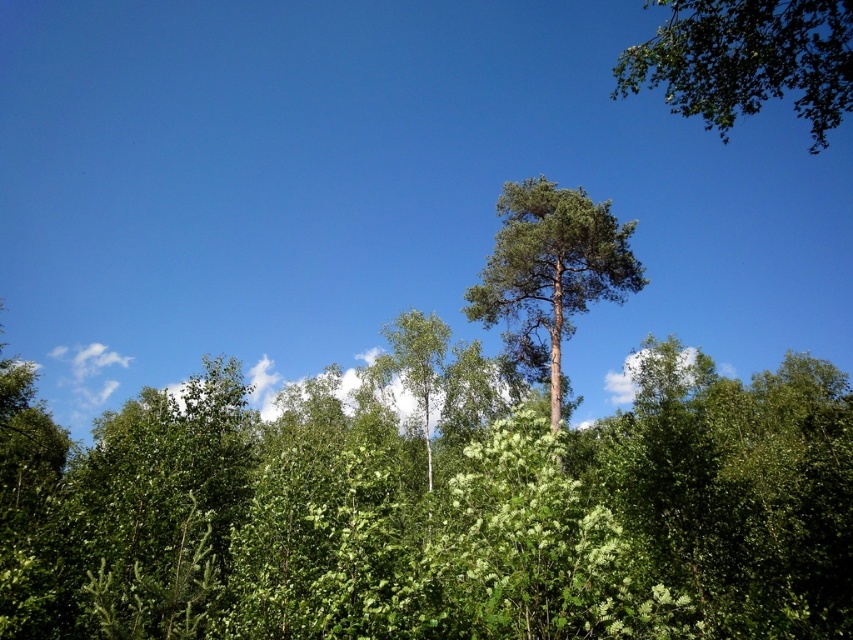
Is point (830, 474) positioned behind point (776, 28)?

Yes.

Is point (579, 589) more distant than point (672, 93)?

No, it is in front of (672, 93).

I want to click on green leafy forest at center, so (x=434, y=508).

Does green leafy forest at center have a greater height compared to green needle-like at center?

No, green leafy forest at center is not taller than green needle-like at center.

Which is behind, point (759, 561) or point (625, 296)?

Point (625, 296)

The image size is (853, 640). Find the location of `green leafy forest at center`. green leafy forest at center is located at coordinates click(434, 508).

Between green leafy tree at upper right and green needle-like at center, which one is positioned lower?

green needle-like at center

Does point (846, 32) come behind point (560, 369)?

No, it is in front of (560, 369).

Locate an element on the screen. The width and height of the screenshot is (853, 640). green leafy tree at upper right is located at coordinates (746, 60).